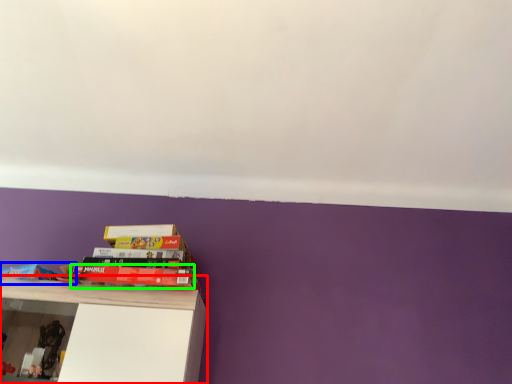
Question: Which is nearer to the shelf (highlighted by a red box)? book (highlighted by a blue box) or book (highlighted by a green box).

Choices:
 (A) book
 (B) book

Answer: (B)